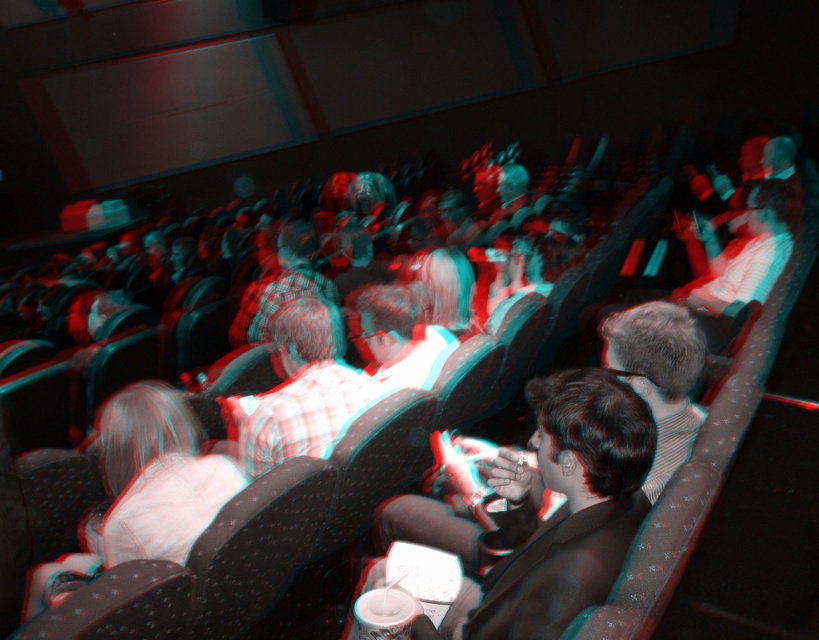
In the scene shown: You are sitting in the front row of the movie theater and want to watch the movie. However, there are two people in front of you, wearing a matte black suit at center and a plaid shirt at center. Which person is blocking your view more due to their height?

The plaid shirt at center is blocking your view more because the matte black suit at center is not as tall as the plaid shirt at center.